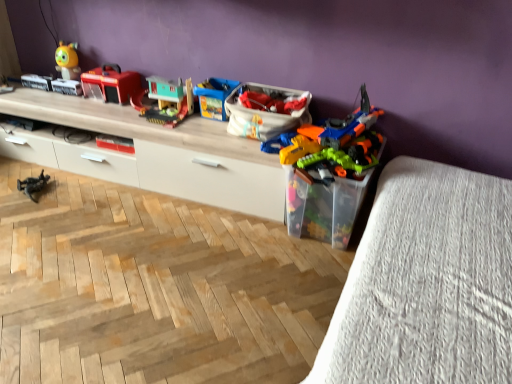
Locate an element on the screen. This screenshot has width=512, height=384. vacant space that's between wooden at upper left and translucent plastic storage box at center-right, acting as the 1th storage box starting from the bottom is located at coordinates (167, 201).